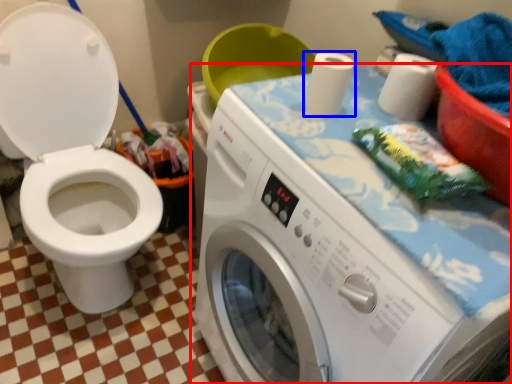
Question: Which object appears closest to the camera in this image, washing machine (highlighted by a red box) or toilet paper (highlighted by a blue box)?

Choices:
 (A) washing machine
 (B) toilet paper

Answer: (A)